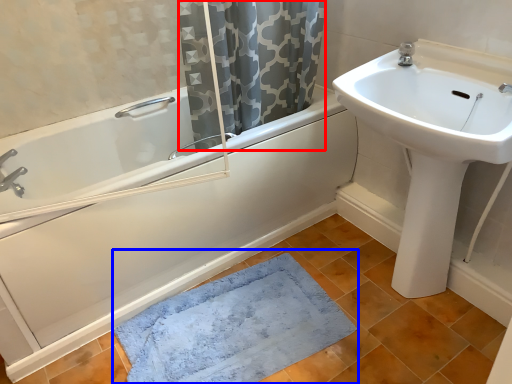
Question: Among these objects, which one is farthest to the camera, shower curtain (highlighted by a red box) or bath mat (highlighted by a blue box)?

Choices:
 (A) shower curtain
 (B) bath mat

Answer: (A)